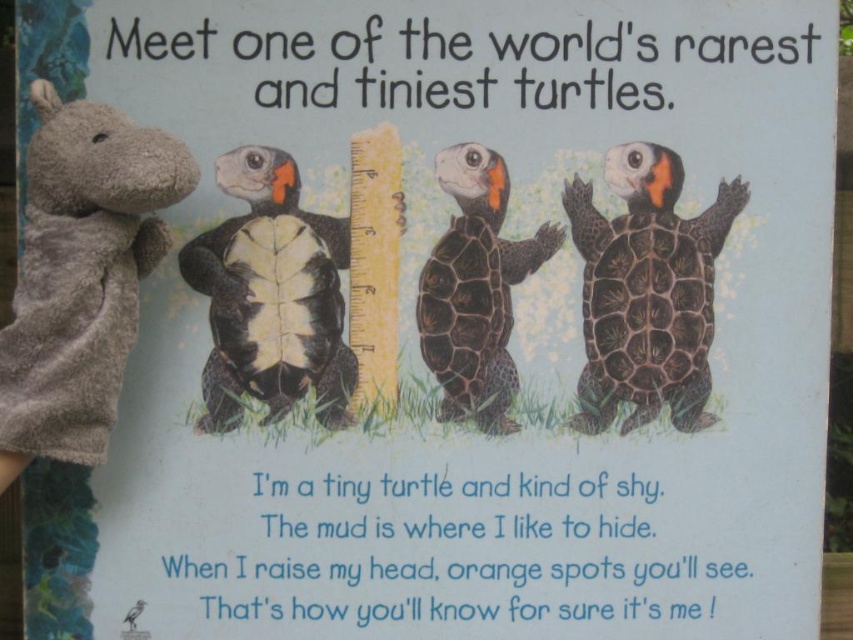
Question: Based on their relative distances, which object is nearer to the black matte turtle at center?

Choices:
 (A) shiny black shell at right
 (B) black textured shell turtle at center

Answer: (B)

Question: Is shiny black shell at right to the left of black matte turtle at center from the viewer's perspective?

Choices:
 (A) no
 (B) yes

Answer: (A)

Question: Which object is farther from the camera taking this photo?

Choices:
 (A) black matte turtle at center
 (B) shiny black shell at right
 (C) black textured shell turtle at center

Answer: (C)

Question: Does shiny black shell at right have a larger size compared to black textured shell turtle at center?

Choices:
 (A) no
 (B) yes

Answer: (B)

Question: In this image, where is shiny black shell at right located relative to black textured shell turtle at center?

Choices:
 (A) above
 (B) below

Answer: (B)

Question: Among these objects, which one is nearest to the camera?

Choices:
 (A) shiny black shell at right
 (B) black textured shell turtle at center
 (C) black matte turtle at center

Answer: (C)